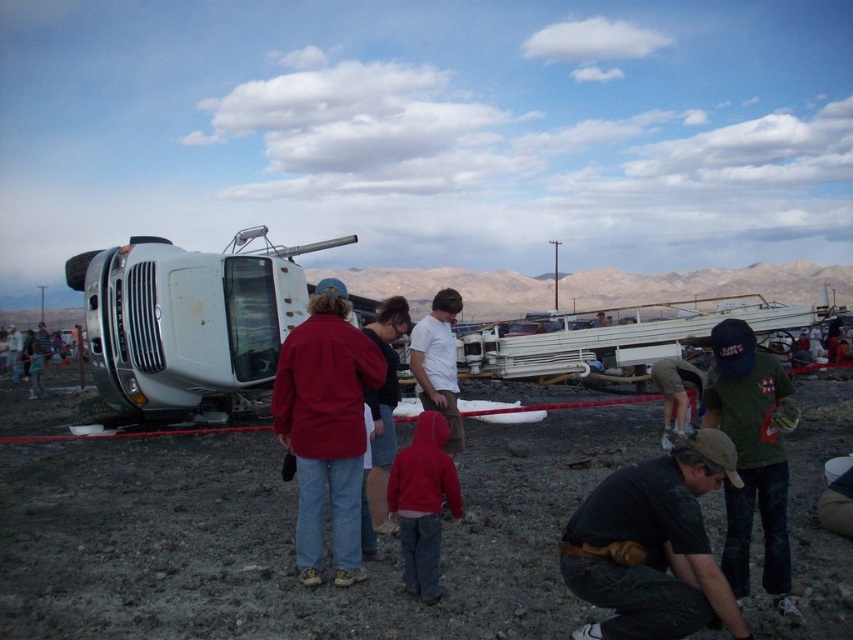
Question: Among these objects, which one is farthest from the camera?

Choices:
 (A) green cotton shirt at center
 (B) dark green t-shirt at lower right
 (C) red jacket at center

Answer: (C)

Question: Does green cotton shirt at center appear under matte red jacket at center?

Choices:
 (A) yes
 (B) no

Answer: (A)

Question: Estimate the real-world distances between objects in this image. Which object is closer to the green cotton shirt at center?

Choices:
 (A) red fleece jacket at center
 (B) red jacket at center

Answer: (A)

Question: Considering the real-world distances, which object is farthest from the green fabric cap at center?

Choices:
 (A) matte red jacket at center
 (B) dark green t-shirt at lower right
 (C) dull brown dirt at center

Answer: (B)

Question: Is white matte shirt at center smaller than green fabric cap at center?

Choices:
 (A) yes
 (B) no

Answer: (A)

Question: Is white matte truck at left in front of red jacket at center?

Choices:
 (A) yes
 (B) no

Answer: (A)